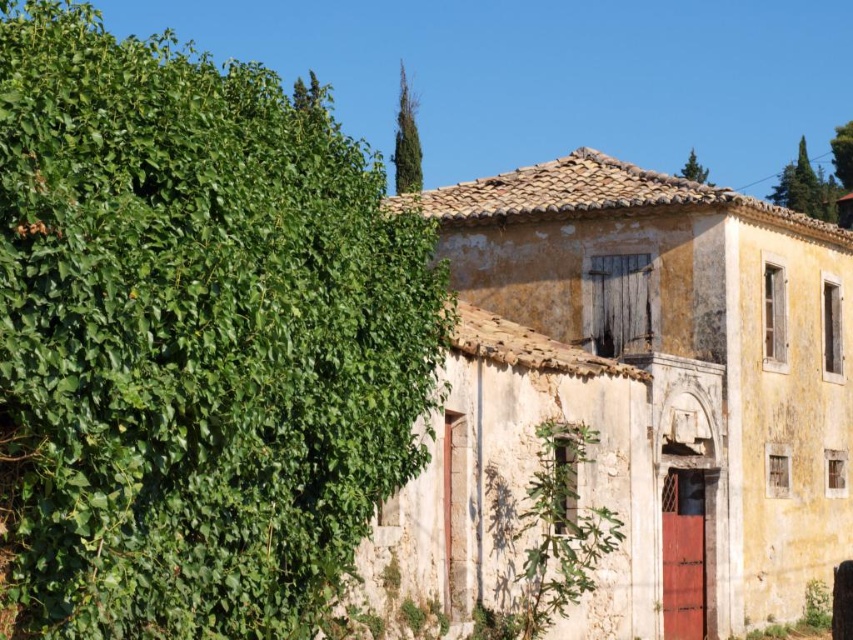
Question: Which of the following is the farthest from the observer?

Choices:
 (A) (809, 486)
 (B) (172, 378)

Answer: (A)

Question: Can you confirm if green leafy hedge at left is positioned to the left of yellowish plaster building at center?

Choices:
 (A) no
 (B) yes

Answer: (B)

Question: Among these objects, which one is farthest from the camera?

Choices:
 (A) green leafy hedge at left
 (B) yellowish plaster building at center

Answer: (B)

Question: Is green leafy hedge at left positioned before yellowish plaster building at center?

Choices:
 (A) no
 (B) yes

Answer: (B)

Question: Which point appears farthest from the camera in this image?

Choices:
 (A) (670, 253)
 (B) (45, 84)

Answer: (A)

Question: Does green leafy hedge at left have a larger size compared to yellowish plaster building at center?

Choices:
 (A) yes
 (B) no

Answer: (A)